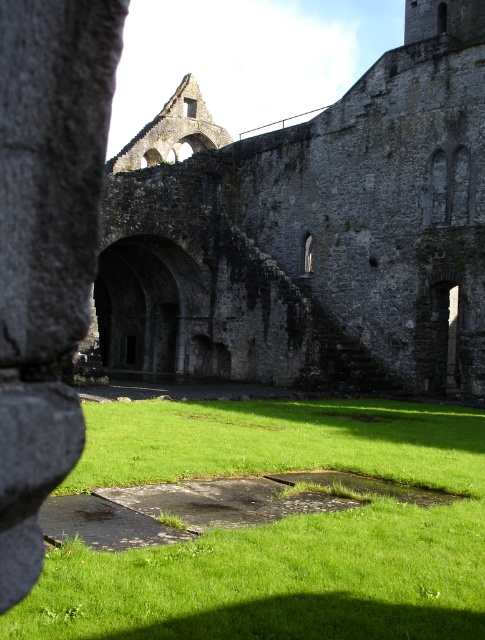
You are standing in the ancient stone structure and want to walk from the stone archway at center to the green grass at center. Which direction should you move?

To move from the stone archway at center to the green grass at center, you should move to the right since the stone archway at center is positioned to the left of the green grass at center.

You are an archaeologist examining the ancient stone structure. You need to determine if the stone archway at center can fit within the width of the green grass at center. Based on the spatial relationship between these two features, what is your conclusion?

The stone archway at center has a larger width than the green grass at center, so the stone archway at center cannot fit within the width of the green grass at center.

You are an archaeologist examining the ancient stone structure. You notice the stone archway at center and the green grass at center. Which object occupies a larger area in the image?

The stone archway at center is bigger than the green grass at center, so the stone archway at center occupies a larger area in the image.